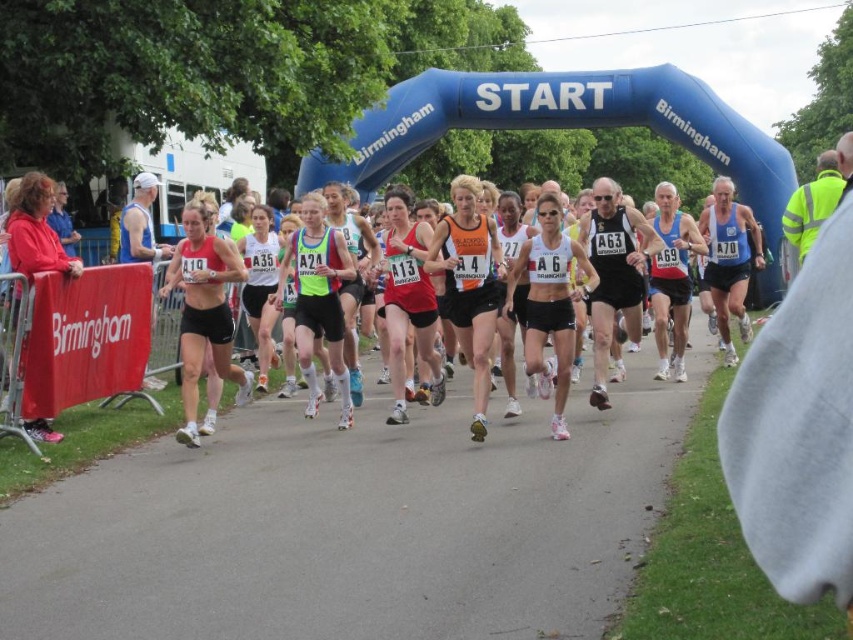
You are a photographer at the race event in Birmingham. You want to capture a photo of the runners at the starting line. Where should you position yourself to ensure the white matte tank top at center is in the center of your photo?

To center the white matte tank top at center in your photo, position yourself directly facing the point at coordinates 0.477 on the x axis and 0.645 on the y axis.

You are a photographer at the race event. You want to take a photo that includes both the asphalt road at center and the matte red tank top at center. Which object should you focus on first if you want to ensure both are in the frame?

The asphalt road at center is larger in size than the matte red tank top at center, so you should focus on the asphalt road at center first to ensure both fit within the frame.